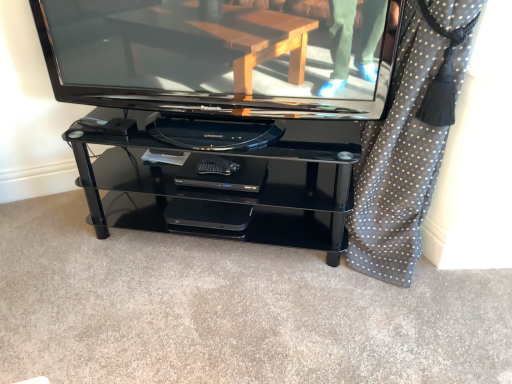
Question: Considering the relative sizes of polka dot fabric at right and glossy black television at center in the image provided, is polka dot fabric at right thinner than glossy black television at center?

Choices:
 (A) yes
 (B) no

Answer: (B)

Question: From the image's perspective, is polka dot fabric at right on top of glossy black television at center?

Choices:
 (A) yes
 (B) no

Answer: (B)

Question: Is polka dot fabric at right wider than glossy black television at center?

Choices:
 (A) no
 (B) yes

Answer: (B)

Question: Is polka dot fabric at right not within glossy black television at center?

Choices:
 (A) no
 (B) yes

Answer: (B)

Question: From a real-world perspective, is polka dot fabric at right on glossy black television at center?

Choices:
 (A) yes
 (B) no

Answer: (B)

Question: In the image, is glossy black television at center on the left side or the right side of polka dot fabric at right?

Choices:
 (A) left
 (B) right

Answer: (A)

Question: In the image, is glossy black television at center positioned in front of or behind polka dot fabric at right?

Choices:
 (A) front
 (B) behind

Answer: (B)

Question: Looking at their shapes, would you say glossy black television at center is wider or thinner than polka dot fabric at right?

Choices:
 (A) wide
 (B) thin

Answer: (B)

Question: Does point (115, 18) appear closer or farther from the camera than point (386, 208)?

Choices:
 (A) closer
 (B) farther

Answer: (A)

Question: From a real-world perspective, is glossy black television at center physically located above or below black plastic dvd player at center?

Choices:
 (A) above
 (B) below

Answer: (A)

Question: Would you say glossy black television at center is to the left or to the right of black plastic dvd player at center in the picture?

Choices:
 (A) left
 (B) right

Answer: (A)

Question: From the image's perspective, is glossy black television at center above or below black plastic dvd player at center?

Choices:
 (A) above
 (B) below

Answer: (A)

Question: In terms of height, does glossy black television at center look taller or shorter compared to black plastic dvd player at center?

Choices:
 (A) short
 (B) tall

Answer: (B)

Question: From the image's perspective, is black plastic dvd player at center above or below glossy black television at center?

Choices:
 (A) below
 (B) above

Answer: (A)

Question: In the image, is black plastic dvd player at center on the left side or the right side of glossy black television at center?

Choices:
 (A) right
 (B) left

Answer: (A)